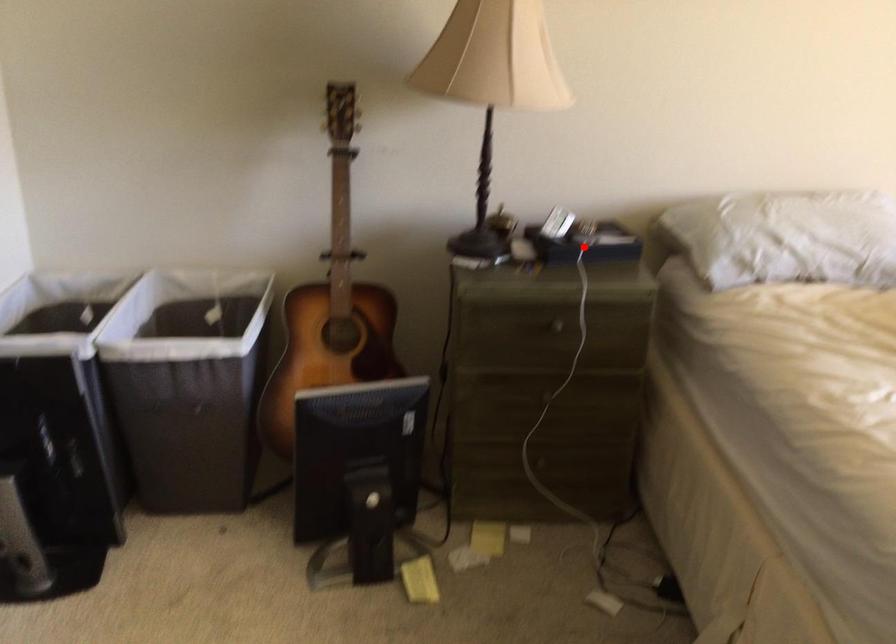
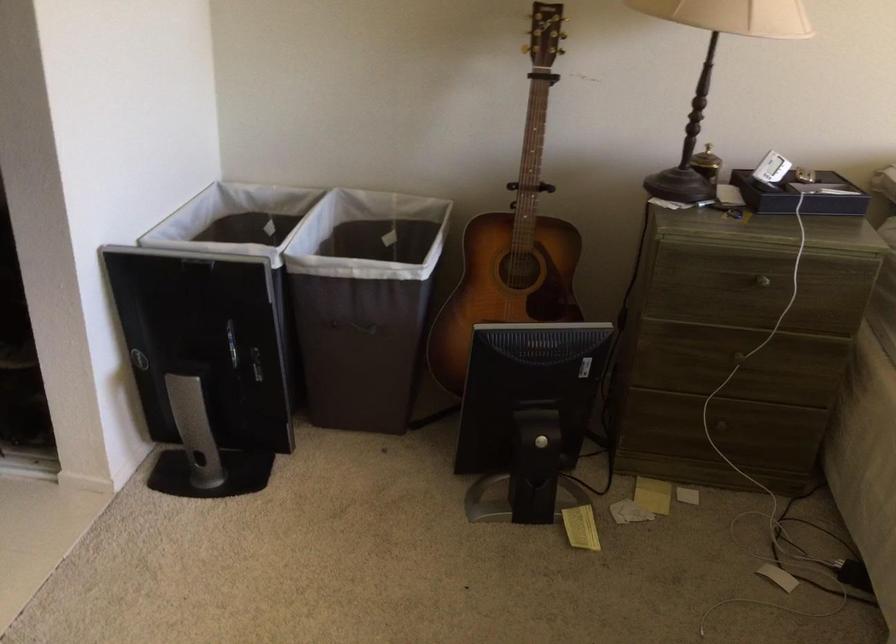
Question: I am providing you with two images of the same scene from different viewpoints. A red point is marked on the first image. Can you still see the location of the red point in image 2?

Choices:
 (A) Yes
 (B) No

Answer: (A)